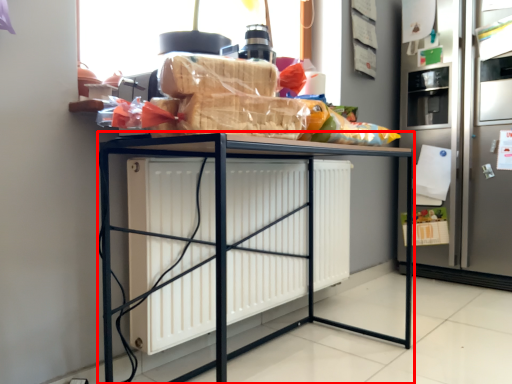
Question: Considering the relative positions of furniture (annotated by the red box) and fridge in the image provided, where is furniture (annotated by the red box) located with respect to the staircase?

Choices:
 (A) right
 (B) left

Answer: (B)